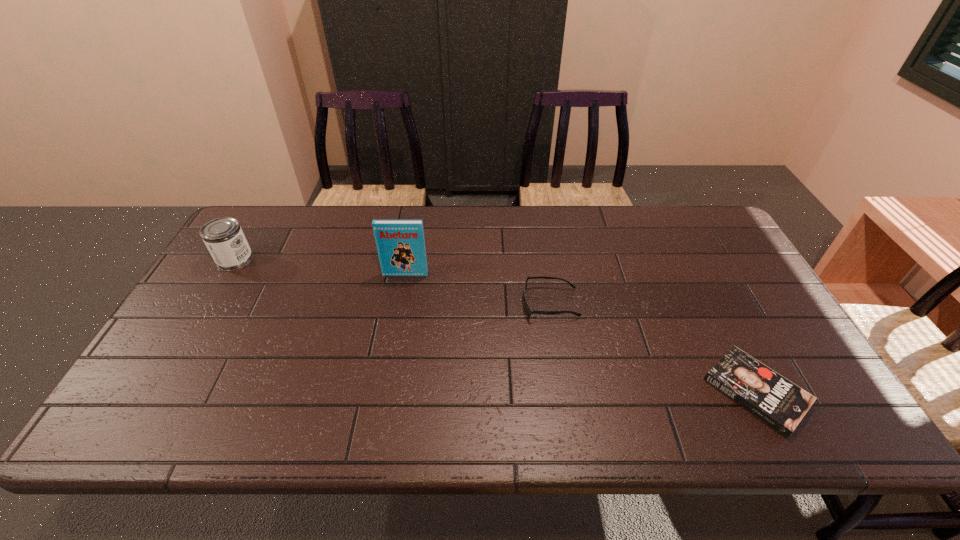
In the image, there is a desktop. What are the coordinates of `vacant space at the far edge` in the screenshot? It's located at (291, 248).

Locate an element on the screen. This screenshot has width=960, height=540. vacant space at the near edge of the desktop is located at coordinates (351, 436).

Where is `vacant region at the left edge of the desktop`? This screenshot has width=960, height=540. vacant region at the left edge of the desktop is located at coordinates (x=178, y=372).

Locate an element on the screen. This screenshot has width=960, height=540. free region at the right edge of the desktop is located at coordinates (732, 298).

Locate an element on the screen. Image resolution: width=960 pixels, height=540 pixels. free area in between the right book and the third object from right to left is located at coordinates (581, 333).

At what (x,y) coordinates should I click in order to perform the action: click on free space that is in between the shorter book and the taller book. Please return your answer as a coordinate pair (x, y). Looking at the image, I should click on (581, 333).

Find the location of `vacant space in between the left book and the second tallest object`. vacant space in between the left book and the second tallest object is located at coordinates (321, 267).

Find the location of `free point between the second object from right to left and the second object from left to right`. free point between the second object from right to left and the second object from left to right is located at coordinates (478, 288).

This screenshot has height=540, width=960. Identify the location of free spot between the shortest object and the third shortest object. (495, 326).

Image resolution: width=960 pixels, height=540 pixels. What are the coordinates of `unoccupied area between the shortest object and the third nearest object` in the screenshot? It's located at (581, 333).